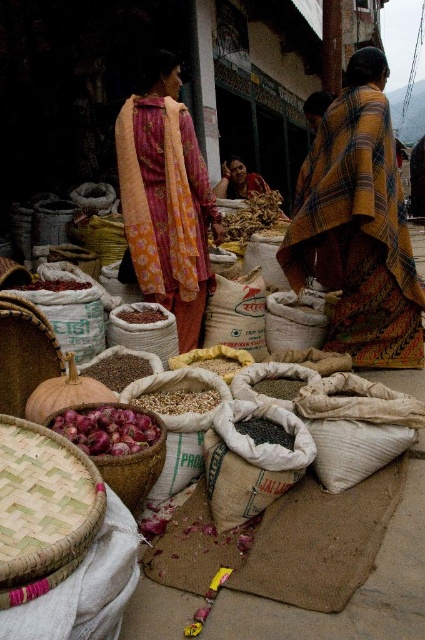
Locate an element on the screen. The image size is (425, 640). plaid fabric shawl at center is located at coordinates (357, 225).

Which is behind, point (326, 275) or point (271, 436)?

The point (326, 275) is behind.

Where is `plaid fabric shawl at center`? The image size is (425, 640). plaid fabric shawl at center is located at coordinates (357, 225).

Does purple glossy onions at center have a larger size compared to black matte seeds at center?

Yes, purple glossy onions at center is bigger than black matte seeds at center.

Can you confirm if purple glossy onions at center is shorter than black matte seeds at center?

No, purple glossy onions at center is not shorter than black matte seeds at center.

Where is `purple glossy onions at center`? purple glossy onions at center is located at coordinates (107, 428).

Where is `purple glossy onions at center`? This screenshot has height=640, width=425. purple glossy onions at center is located at coordinates (107, 428).

Between bamboo weave basket at lower left and brown matte seeds at center, which one has less height?

brown matte seeds at center is shorter.

Who is taller, bamboo weave basket at lower left or brown matte seeds at center?

bamboo weave basket at lower left

Is point (2, 580) positioned behind point (142, 360)?

No, (2, 580) is in front of (142, 360).

Locate an element on the screen. This screenshot has width=425, height=640. bamboo weave basket at lower left is located at coordinates (42, 509).